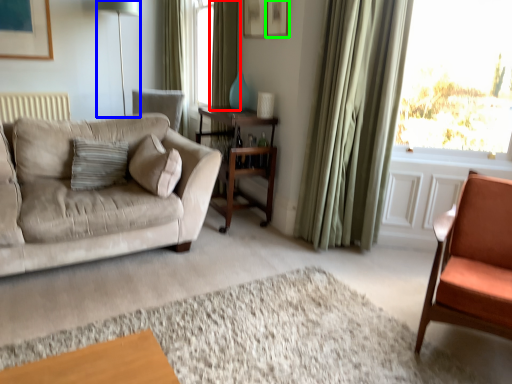
Question: Considering the real-world distances, which object is farthest from curtain (highlighted by a red box)? table lamp (highlighted by a blue box) or picture frame (highlighted by a green box)?

Choices:
 (A) table lamp
 (B) picture frame

Answer: (A)